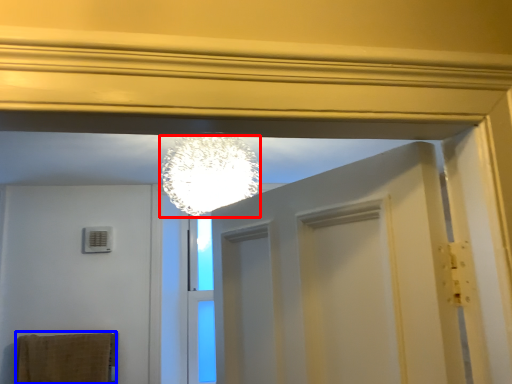
Question: Which of the following is the farthest to the observer, lamp (highlighted by a red box) or bath towel (highlighted by a blue box)?

Choices:
 (A) lamp
 (B) bath towel

Answer: (B)